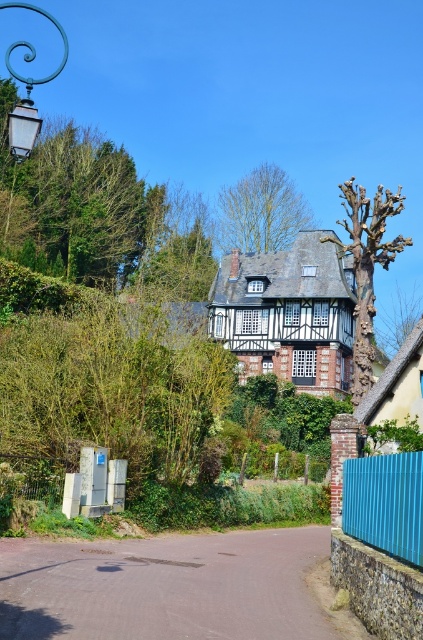
Based on the photo, you are a visitor approaching the house and notice the bare wood tree at right and the teal wrought iron lamp post at upper left. Which object appears larger in the scene?

The teal wrought iron lamp post at upper left appears larger than the bare wood tree at right.

You are a visitor approaching the traditional half timbered house. You notice a green leafy tree at center and a teal wrought iron lamp post at upper left. Which object is closer to the house?

The green leafy tree at center is closer to the house than the teal wrought iron lamp post at upper left because it is positioned in the foreground near the road leading to the house, while the lamp post is placed further back at the upper left corner of the scene.